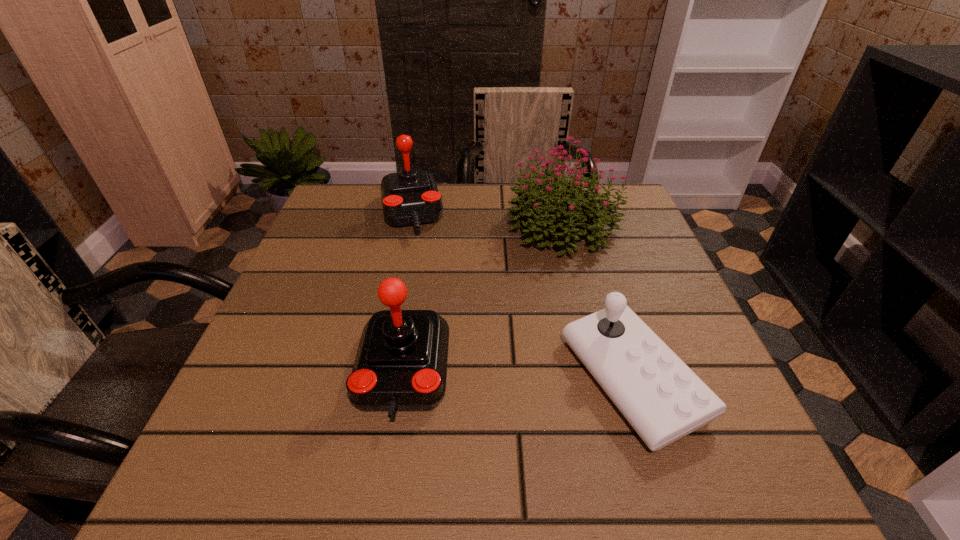
Identify the location of bouquet. (535, 199).

Where is `the farthest joystick`? Image resolution: width=960 pixels, height=540 pixels. the farthest joystick is located at coordinates (409, 197).

Where is `the shortest object`? This screenshot has height=540, width=960. the shortest object is located at coordinates (663, 400).

You are a GUI agent. You are given a task and a screenshot of the screen. Output one action in this format:
    pyautogui.click(x=<x>, y=<y>)
    Task: Click on the shortest joystick
    
    Given the screenshot: What is the action you would take?
    pyautogui.click(x=663, y=400)

Where is `vacant space situated 0.230m on the left of the bouquet`? This screenshot has height=540, width=960. vacant space situated 0.230m on the left of the bouquet is located at coordinates (414, 226).

The height and width of the screenshot is (540, 960). I want to click on blank space located 0.300m on the front of the farthest joystick, so click(x=385, y=338).

Find the location of a particular element. blank space located on the back of the shortest object is located at coordinates (592, 251).

Image resolution: width=960 pixels, height=540 pixels. Find the location of `bouquet that is at the far edge`. bouquet that is at the far edge is located at coordinates (535, 199).

You are a GUI agent. You are given a task and a screenshot of the screen. Output one action in this format:
    pyautogui.click(x=<x>, y=<y>)
    Task: Click on the joystick that is at the far edge
    The width and height of the screenshot is (960, 540).
    Given the screenshot: What is the action you would take?
    pyautogui.click(x=409, y=197)

This screenshot has width=960, height=540. Identify the location of object positioned at the near edge. (663, 400).